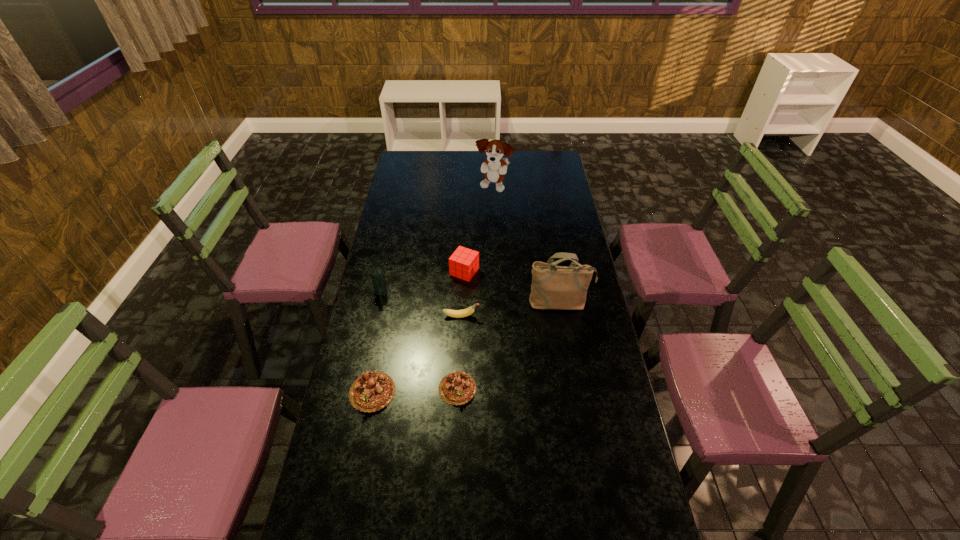
At what (x,y) coordinates should I click in order to perform the action: click on empty space between the farthest object and the fifth shortest object. Please return your answer as a coordinate pair (x, y). Image resolution: width=960 pixels, height=540 pixels. Looking at the image, I should click on [438, 239].

Where is `free space between the shortest object and the rightmost object`? The height and width of the screenshot is (540, 960). free space between the shortest object and the rightmost object is located at coordinates (509, 346).

You are a GUI agent. You are given a task and a screenshot of the screen. Output one action in this format:
    pyautogui.click(x=<x>, y=<y>)
    Task: Click on the vacant area that lies between the cube and the vodka
    This screenshot has height=540, width=960.
    Given the screenshot: What is the action you would take?
    pyautogui.click(x=422, y=281)

At what (x,y) coordinates should I click in order to perform the action: click on free spot between the rightmost object and the banana. Please return your answer as a coordinate pair (x, y). The height and width of the screenshot is (540, 960). Looking at the image, I should click on (511, 310).

At what (x,y) coordinates should I click in order to perform the action: click on object that is the fourth closest to the banana. Please return your answer as a coordinate pair (x, y). This screenshot has width=960, height=540. Looking at the image, I should click on (378, 279).

Identify which object is the second closest to the sixth nearest object. Please provide its 2D coordinates. Your answer should be formatted as a tuple, i.e. [(x, y)], where the tuple contains the x and y coordinates of a point satisfying the conditions above.

[(555, 287)]

The height and width of the screenshot is (540, 960). Identify the location of free location that satisfies the following two spatial constraints: 1. at the stem of the banana; 2. on the front side of the shortest object. (x=458, y=388).

Identify the location of vacant space that satisfies the following two spatial constraints: 1. at the stem of the banana; 2. on the front side of the taller chocolate cake. (458, 392).